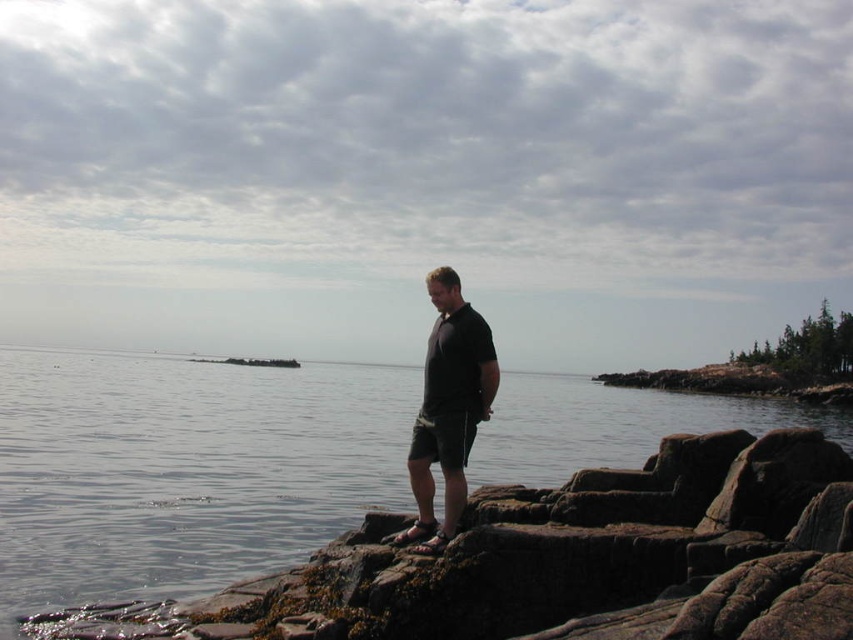
Does point (123, 484) come in front of point (428, 358)?

No, it is not.

What are the coordinates of `clear water at center` in the screenshot? It's located at (183, 468).